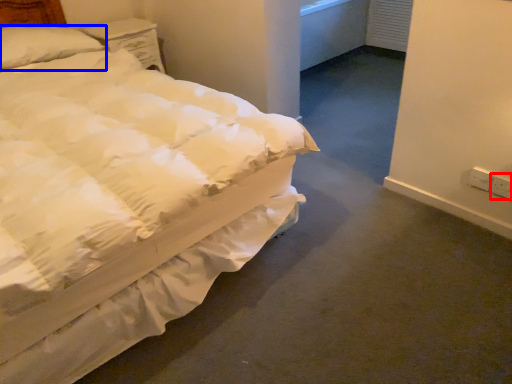
Question: Which point is further to the camera, electric outlet (highlighted by a red box) or pillow (highlighted by a blue box)?

Choices:
 (A) electric outlet
 (B) pillow

Answer: (B)